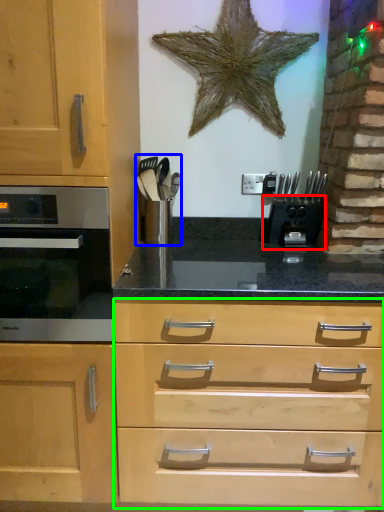
Question: Which is nearer to the coffee machine (highlighted by a red box)? appliance (highlighted by a blue box) or drawer (highlighted by a green box).

Choices:
 (A) appliance
 (B) drawer

Answer: (A)